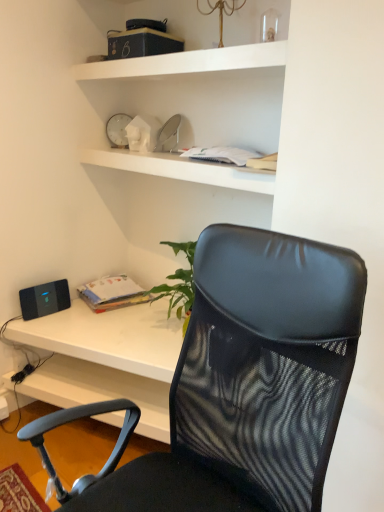
Image resolution: width=384 pixels, height=512 pixels. I want to click on free location in front of matte paper book at center, so click(97, 322).